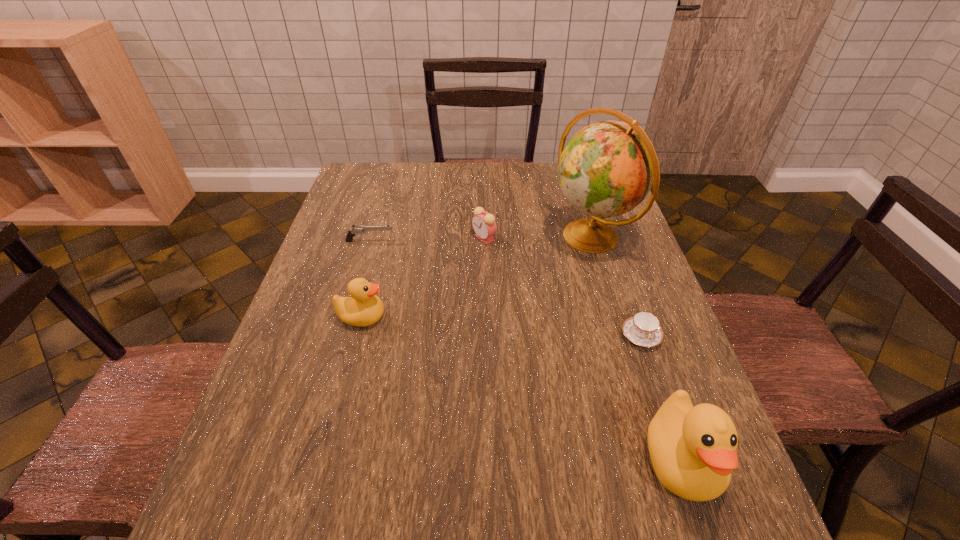
Identify the location of the farther duck. (363, 308).

Find the location of `the shorter duck`. the shorter duck is located at coordinates (363, 308).

Identify the location of the second tallest object. (693, 450).

Where is `the taller duck`? The image size is (960, 540). the taller duck is located at coordinates (693, 450).

At what (x,y) coordinates should I click in order to perform the action: click on the tallest object. Please return your answer as a coordinate pair (x, y). Looking at the image, I should click on pos(606,169).

The width and height of the screenshot is (960, 540). What are the coordinates of `alarm clock` in the screenshot? It's located at (484, 225).

The height and width of the screenshot is (540, 960). Find the location of `the third object from left to right`. the third object from left to right is located at coordinates (484, 225).

Image resolution: width=960 pixels, height=540 pixels. In order to click on the fifth tallest object in this screenshot , I will do `click(355, 230)`.

Locate an element on the screen. This screenshot has height=540, width=960. teacup is located at coordinates (643, 329).

Image resolution: width=960 pixels, height=540 pixels. Find the location of `vacant space located at the beak of the farther duck`. vacant space located at the beak of the farther duck is located at coordinates (508, 317).